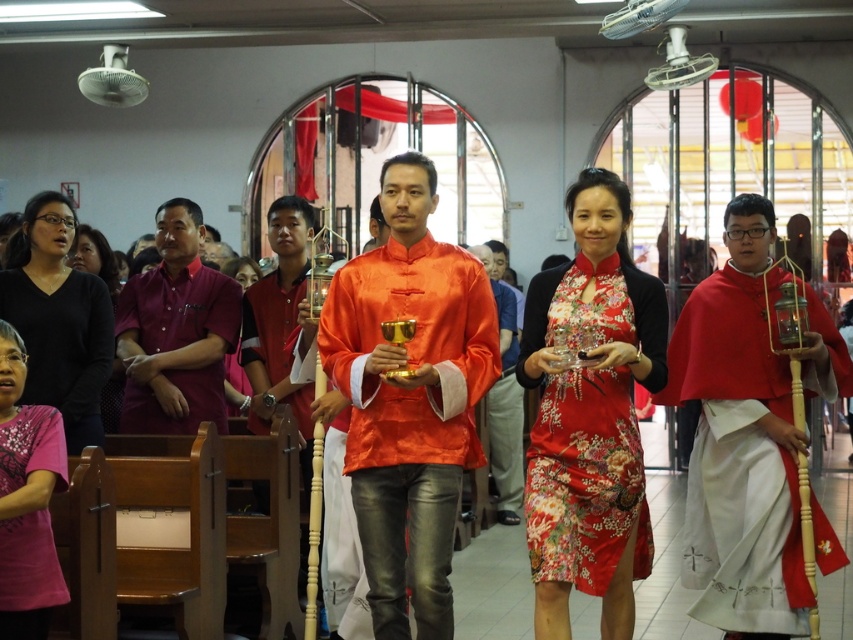
Question: Which point appears farthest from the camera in this image?

Choices:
 (A) (74, 308)
 (B) (53, 557)
 (C) (582, 301)
 (D) (225, 381)

Answer: (D)

Question: Is satin orange robe at center above matte pink blouse at center?

Choices:
 (A) no
 (B) yes

Answer: (B)

Question: Is silky floral dress at center to the right of pink matte shirt at lower left from the viewer's perspective?

Choices:
 (A) yes
 (B) no

Answer: (A)

Question: Which object is closer to the camera taking this photo?

Choices:
 (A) red fabric shirt at center
 (B) matte black glasses at upper left
 (C) matte pink blouse at center
 (D) silky floral dress at center

Answer: (D)

Question: Which point is farther to the camera?

Choices:
 (A) red fabric shirt at center
 (B) satin orange robe at center
 (C) matte red cape at center
 (D) silky orange robe at center

Answer: (D)

Question: Can you confirm if matte red cape at center is wider than matte pink blouse at center?

Choices:
 (A) yes
 (B) no

Answer: (A)